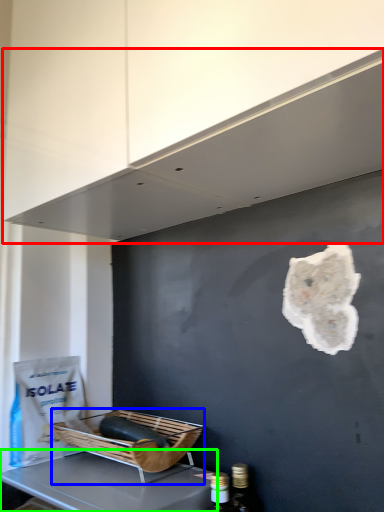
Question: Which object is positioned closest to exhaust hood (highlighted by a red box)? Select from basket (highlighted by a blue box) and furniture (highlighted by a green box).

Choices:
 (A) basket
 (B) furniture

Answer: (A)